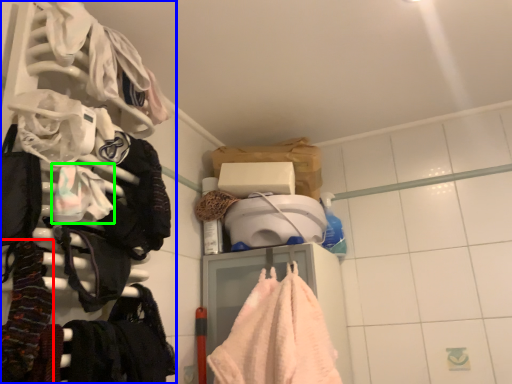
Question: Which object is positioned farthest from clothing (highlighted by a red box)? Select from closet (highlighted by a blue box) and clothing (highlighted by a green box).

Choices:
 (A) closet
 (B) clothing

Answer: (A)